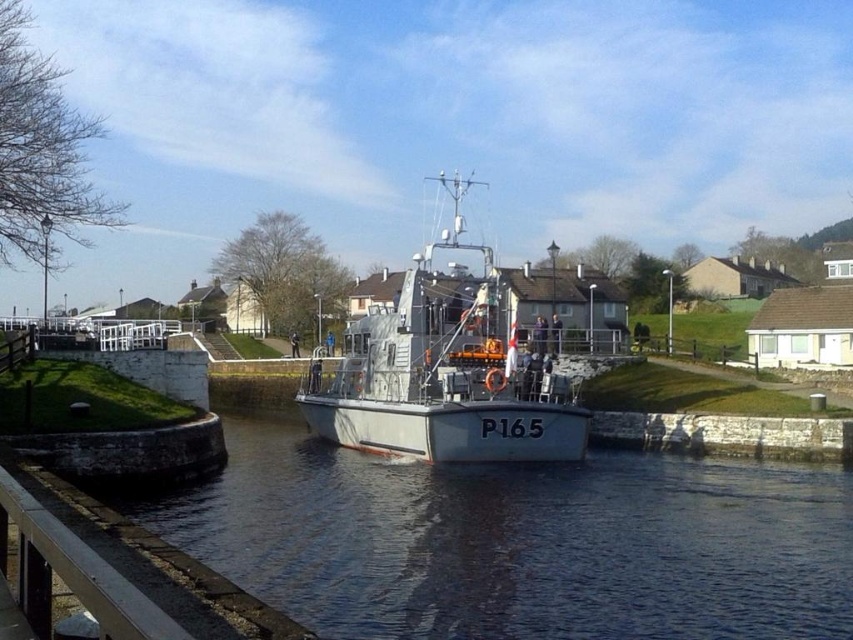
Question: Which object appears farthest from the camera in this image?

Choices:
 (A) white smooth water at center
 (B) metallic gray boat at center

Answer: (B)

Question: Is white smooth water at center above metallic gray boat at center?

Choices:
 (A) no
 (B) yes

Answer: (A)

Question: Does white smooth water at center appear on the right side of metallic gray boat at center?

Choices:
 (A) yes
 (B) no

Answer: (A)

Question: Considering the relative positions of white smooth water at center and metallic gray boat at center in the image provided, where is white smooth water at center located with respect to metallic gray boat at center?

Choices:
 (A) right
 (B) left

Answer: (A)

Question: Which object appears farthest from the camera in this image?

Choices:
 (A) metallic gray boat at center
 (B) white smooth water at center

Answer: (A)